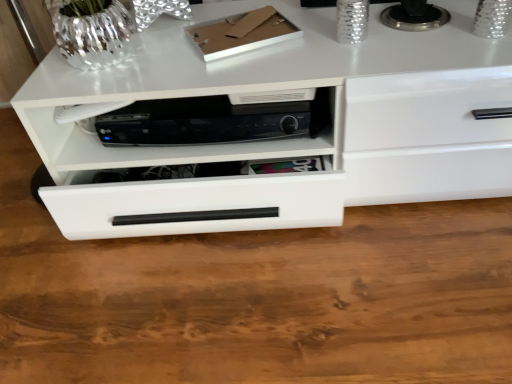
Question: In terms of height, does white glossy drawer at center look taller or shorter compared to black plastic dvd player at center?

Choices:
 (A) short
 (B) tall

Answer: (B)

Question: From the image's perspective, relative to black plastic dvd player at center, is white glossy drawer at center above or below?

Choices:
 (A) above
 (B) below

Answer: (A)

Question: From a real-world perspective, relative to black plastic dvd player at center, is white glossy drawer at center vertically above or below?

Choices:
 (A) above
 (B) below

Answer: (B)

Question: Is black plastic dvd player at center to the left or to the right of white glossy drawer at center in the image?

Choices:
 (A) left
 (B) right

Answer: (A)

Question: Based on their sizes in the image, would you say black plastic dvd player at center is bigger or smaller than white glossy drawer at center?

Choices:
 (A) big
 (B) small

Answer: (B)

Question: Which is correct: black plastic dvd player at center is inside white glossy drawer at center, or outside of it?

Choices:
 (A) inside
 (B) outside

Answer: (A)

Question: From a real-world perspective, is black plastic dvd player at center positioned above or below white glossy drawer at center?

Choices:
 (A) below
 (B) above

Answer: (B)